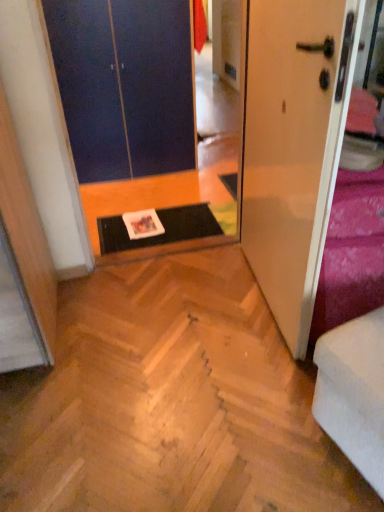
Question: From a real-world perspective, is natural wood parquet floor at center physically above velvet purple bedding at right?

Choices:
 (A) yes
 (B) no

Answer: (B)

Question: Would you consider natural wood parquet floor at center to be distant from velvet purple bedding at right?

Choices:
 (A) yes
 (B) no

Answer: (B)

Question: Considering the relative positions of natural wood parquet floor at center and velvet purple bedding at right in the image provided, is natural wood parquet floor at center to the right of velvet purple bedding at right from the viewer's perspective?

Choices:
 (A) no
 (B) yes

Answer: (A)

Question: Is natural wood parquet floor at center shorter than velvet purple bedding at right?

Choices:
 (A) yes
 (B) no

Answer: (A)

Question: From the image's perspective, is natural wood parquet floor at center located beneath velvet purple bedding at right?

Choices:
 (A) no
 (B) yes

Answer: (B)

Question: In terms of size, does white fabric armchair at lower right appear bigger or smaller than blue matte door at upper left, which ranks as the 2th door in right-to-left order?

Choices:
 (A) big
 (B) small

Answer: (B)

Question: Relative to blue matte door at upper left, the first door viewed from the back, is white fabric armchair at lower right in front or behind?

Choices:
 (A) front
 (B) behind

Answer: (A)

Question: From the image's perspective, is white fabric armchair at lower right positioned above or below blue matte door at upper left, the first door viewed from the left?

Choices:
 (A) above
 (B) below

Answer: (B)

Question: In terms of width, does white fabric armchair at lower right look wider or thinner when compared to blue matte door at upper left, which ranks as the 2th door in right-to-left order?

Choices:
 (A) thin
 (B) wide

Answer: (A)

Question: From the image's perspective, is natural wood parquet floor at center located above or below white fabric armchair at lower right?

Choices:
 (A) above
 (B) below

Answer: (A)

Question: Considering their positions, is natural wood parquet floor at center located in front of or behind white fabric armchair at lower right?

Choices:
 (A) behind
 (B) front

Answer: (A)

Question: Does point (134, 490) appear closer or farther from the camera than point (382, 437)?

Choices:
 (A) farther
 (B) closer

Answer: (A)

Question: Choose the correct answer: Is natural wood parquet floor at center inside white fabric armchair at lower right or outside it?

Choices:
 (A) inside
 (B) outside

Answer: (B)

Question: Considering their positions, is natural wood parquet floor at center located in front of or behind blue matte door at upper left, the first door viewed from the back?

Choices:
 (A) behind
 (B) front

Answer: (B)

Question: Which is correct: natural wood parquet floor at center is inside blue matte door at upper left, the first door viewed from the left, or outside of it?

Choices:
 (A) outside
 (B) inside

Answer: (A)